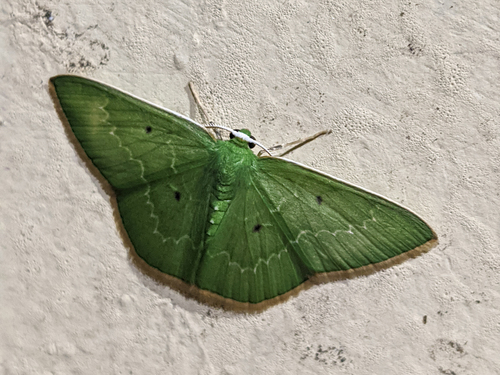
Where is `cement wall`? cement wall is located at coordinates (413, 140).